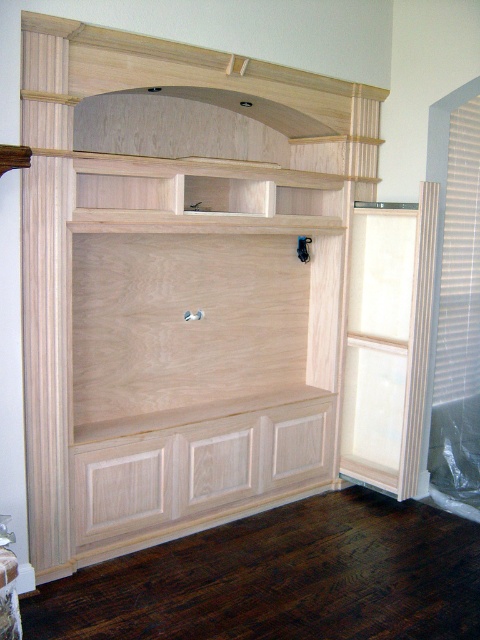
Question: Which object is the closest to the natural wood drawer at lower center?

Choices:
 (A) natural wood shelf at upper center
 (B) natural wood bookshelf at center

Answer: (B)

Question: Estimate the real-world distances between objects in this image. Which object is closer to the natural wood shelf at upper center?

Choices:
 (A) natural wood bookshelf at center
 (B) natural wood drawer at lower center

Answer: (A)

Question: Considering the real-world distances, which object is closest to the natural wood drawer at lower center?

Choices:
 (A) natural wood bookshelf at center
 (B) natural wood shelf at upper center

Answer: (A)

Question: Is natural wood drawer at lower center smaller than natural wood shelf at upper center?

Choices:
 (A) yes
 (B) no

Answer: (B)

Question: Does natural wood bookshelf at center appear on the right side of natural wood shelf at upper center?

Choices:
 (A) no
 (B) yes

Answer: (A)

Question: Does natural wood bookshelf at center have a larger size compared to natural wood drawer at lower center?

Choices:
 (A) yes
 (B) no

Answer: (A)